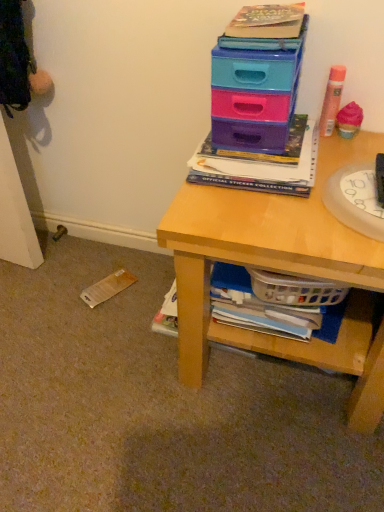
The image size is (384, 512). Find the location of `blank space situated above hardcover book at upper center (from a real-world perspective)`. blank space situated above hardcover book at upper center (from a real-world perspective) is located at coordinates (243, 154).